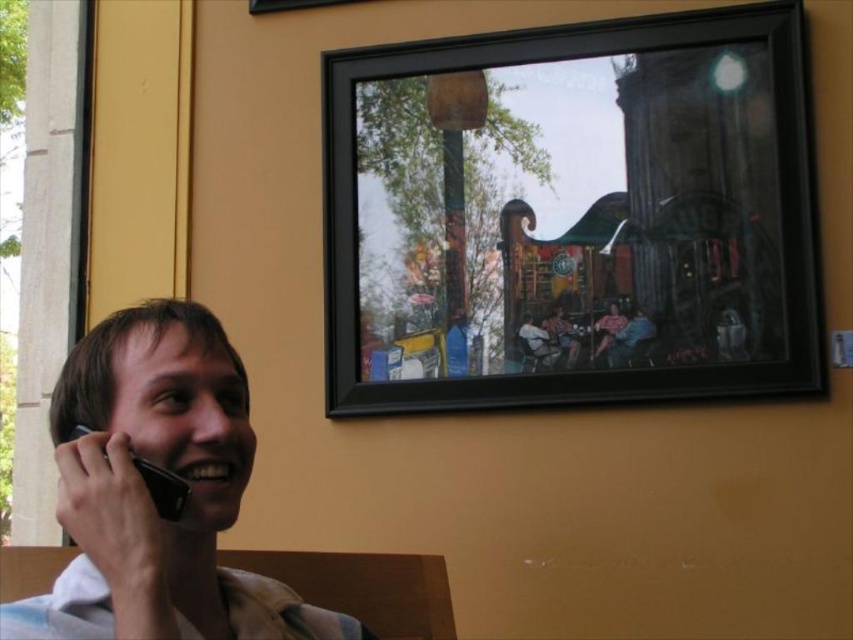
Is black matte picture frame at upper right wider than matte black phone at left?

Yes, black matte picture frame at upper right is wider than matte black phone at left.

Is black matte picture frame at upper right further to camera compared to matte black phone at left?

That is True.

What do you see at coordinates (582, 221) in the screenshot?
I see `black matte picture frame at upper right` at bounding box center [582, 221].

This screenshot has width=853, height=640. Find the location of `black matte picture frame at upper right`. black matte picture frame at upper right is located at coordinates tap(582, 221).

Is matte black phone at left to the right of black matte smartphone at left from the viewer's perspective?

Correct, you'll find matte black phone at left to the right of black matte smartphone at left.

Does point (222, 387) lie behind point (154, 488)?

Yes, point (222, 387) is farther from viewer.

Between point (216, 344) and point (177, 493), which one is positioned behind?

The point (216, 344) is more distant.

This screenshot has height=640, width=853. I want to click on matte black phone at left, so click(x=149, y=497).

Can you confirm if black matte picture frame at upper right is positioned above black matte smartphone at left?

Yes, black matte picture frame at upper right is above black matte smartphone at left.

Does black matte picture frame at upper right have a greater width compared to black matte smartphone at left?

Yes.

Is point (721, 369) less distant than point (177, 500)?

No, (721, 369) is behind (177, 500).

Find the location of a particular element. black matte picture frame at upper right is located at coordinates (582, 221).